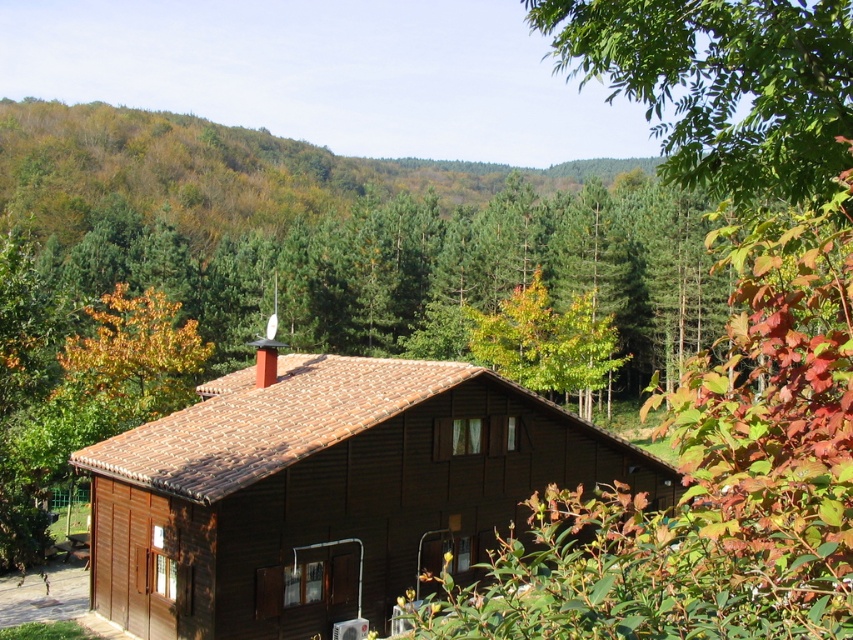
Who is taller, brown wooden cabin at center or yellow-green leaves at upper center?

Standing taller between the two is yellow-green leaves at upper center.

Between point (656, 500) and point (181, 394), which one is positioned in front?

Positioned in front is point (656, 500).

You are a GUI agent. You are given a task and a screenshot of the screen. Output one action in this format:
    pyautogui.click(x=<x>, y=<y>)
    Task: Click on the brown wooden cabin at center
    
    Given the screenshot: What is the action you would take?
    pyautogui.click(x=326, y=492)